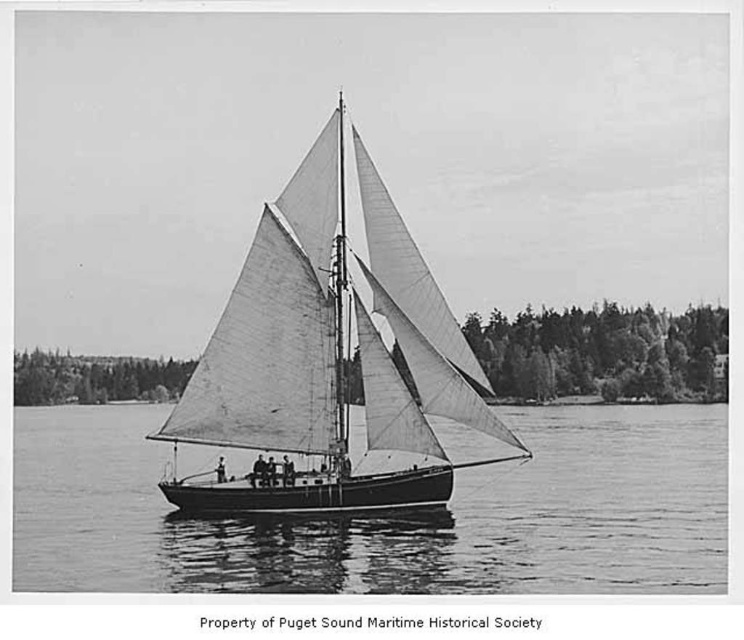
In the scene shown: Is smooth water at center bigger than white canvas sail at center?

Yes.

Is smooth water at center below white canvas sail at center?

Yes, smooth water at center is below white canvas sail at center.

What do you see at coordinates (388, 515) in the screenshot? I see `smooth water at center` at bounding box center [388, 515].

The width and height of the screenshot is (744, 640). Identify the location of smooth water at center. (388, 515).